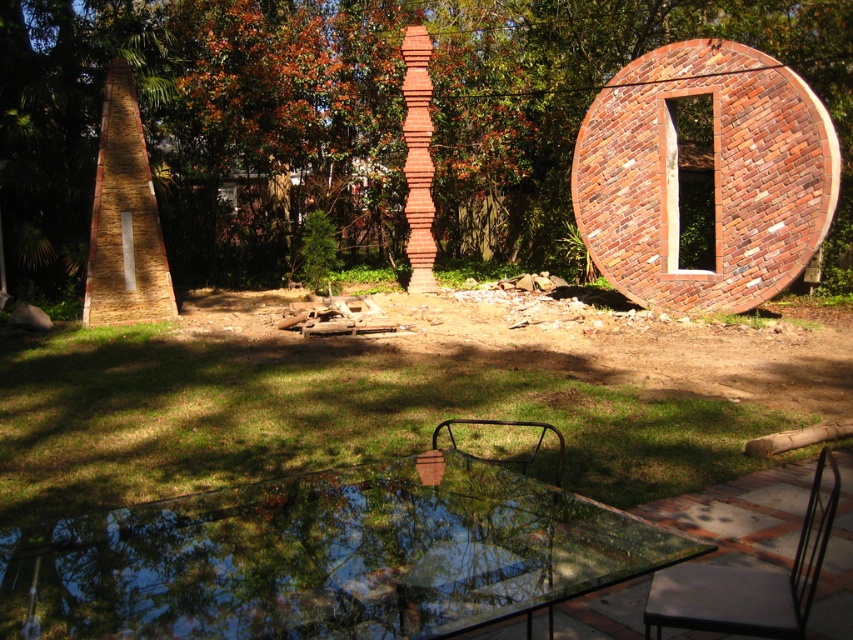
Looking at this image, is transparent glass table at center positioned at the back of black metal chair at lower center?

No, it is not.

Can you confirm if transparent glass table at center is taller than black metal chair at lower center?

Incorrect, transparent glass table at center's height is not larger of black metal chair at lower center's.

What do you see at coordinates (326, 556) in the screenshot? I see `transparent glass table at center` at bounding box center [326, 556].

What are the coordinates of `transparent glass table at center` in the screenshot? It's located at (326, 556).

Does transparent glass table at center have a lesser width compared to metallic black chair at lower right?

No, transparent glass table at center is not thinner than metallic black chair at lower right.

Does transparent glass table at center have a greater width compared to metallic black chair at lower right?

Yes.

Find the location of `transparent glass table at center`. transparent glass table at center is located at coordinates (326, 556).

You are a GUI agent. You are given a task and a screenshot of the screen. Output one action in this format:
    pyautogui.click(x=<x>, y=<y>)
    Task: Click on the transparent glass table at center
    This screenshot has height=640, width=853.
    Given the screenshot: What is the action you would take?
    pyautogui.click(x=326, y=556)

Can you confirm if green leafy tree at upper center is positioned below black metal chair at lower center?

No.

Identify the location of green leafy tree at upper center. (349, 120).

Is point (263, 172) behind point (509, 420)?

Yes, it is.

Identify the location of green leafy tree at upper center. This screenshot has width=853, height=640. (349, 120).